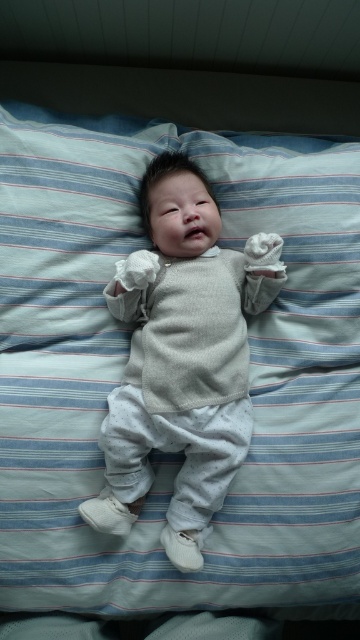
Can you confirm if light blue striped pillow at center is bigger than light gray knit sweater at center?

Correct, light blue striped pillow at center is larger in size than light gray knit sweater at center.

Who is positioned more to the left, light blue striped pillow at center or light gray knit sweater at center?

From the viewer's perspective, light blue striped pillow at center appears more on the left side.

At what (x,y) coordinates should I click in order to perform the action: click on light blue striped pillow at center. Please return your answer as a coordinate pair (x, y). Image resolution: width=360 pixels, height=640 pixels. Looking at the image, I should click on (146, 243).

Where is `light blue striped pillow at center`? This screenshot has width=360, height=640. light blue striped pillow at center is located at coordinates (146, 243).